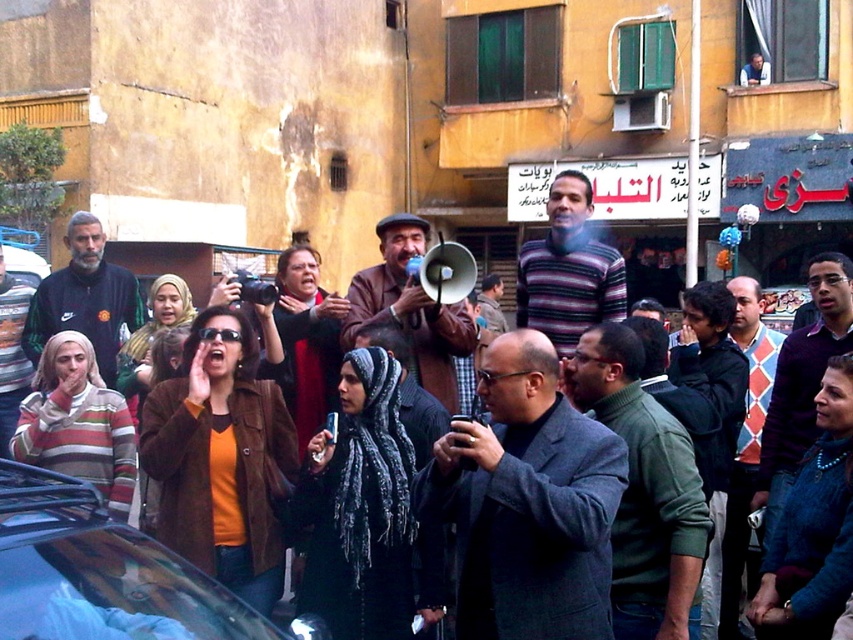
Question: Which point is farther to the camera?

Choices:
 (A) (755, 358)
 (B) (450, 397)
 (C) (776, 436)
 (D) (714, 634)

Answer: (A)

Question: Does dark gray suit at center lie in front of green wool sweater at center?

Choices:
 (A) no
 (B) yes

Answer: (B)

Question: Which point is farther from the camera taking this photo?

Choices:
 (A) 397,234
 (B) 490,320

Answer: (B)

Question: Does dark gray suit at center lie in front of dark purple sweater at center?

Choices:
 (A) yes
 (B) no

Answer: (A)

Question: Does dark gray suit at center have a lesser width compared to dark purple sweater at center?

Choices:
 (A) yes
 (B) no

Answer: (B)

Question: Which point is farther to the camera?

Choices:
 (A) metallic silver car at lower left
 (B) black fabric jacket at center
 (C) dark purple sweater at center
 (D) striped wool sweater at center

Answer: (D)